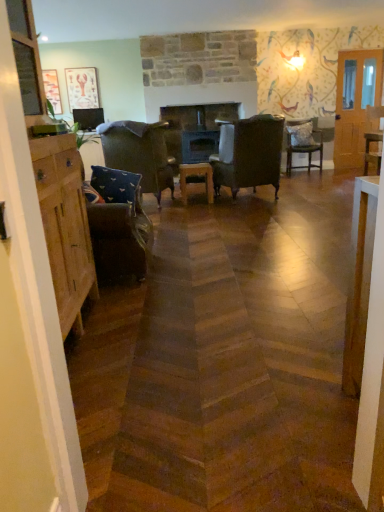
Question: From the image's perspective, does matte paper picture frame at upper left, the 1th picture frame viewed from the right, appear lower than patterned fabric chair at center-right, arranged as the third chair when viewed from the left?

Choices:
 (A) no
 (B) yes

Answer: (A)

Question: Is matte paper picture frame at upper left, the 1th picture frame viewed from the right, looking in the opposite direction of patterned fabric chair at center-right, arranged as the third chair when viewed from the left?

Choices:
 (A) yes
 (B) no

Answer: (B)

Question: Is matte paper picture frame at upper left, the 1th picture frame viewed from the right, to the left of patterned fabric chair at center-right, which is counted as the second chair, starting from the right, from the viewer's perspective?

Choices:
 (A) no
 (B) yes

Answer: (B)

Question: Can you confirm if matte paper picture frame at upper left, the second picture frame when ordered from left to right, is wider than patterned fabric chair at center-right, which is counted as the second chair, starting from the right?

Choices:
 (A) no
 (B) yes

Answer: (A)

Question: Is matte paper picture frame at upper left, the 1th picture frame viewed from the right, positioned far away from patterned fabric chair at center-right, which is counted as the second chair, starting from the right?

Choices:
 (A) yes
 (B) no

Answer: (A)

Question: From a real-world perspective, relative to smooth dark wood fireplace at center, is wooden stool at center vertically above or below?

Choices:
 (A) above
 (B) below

Answer: (B)

Question: Would you say wooden stool at center is to the left or to the right of smooth dark wood fireplace at center in the picture?

Choices:
 (A) right
 (B) left

Answer: (B)

Question: Is wooden stool at center in front of or behind smooth dark wood fireplace at center in the image?

Choices:
 (A) behind
 (B) front

Answer: (B)

Question: In terms of width, does wooden stool at center look wider or thinner when compared to smooth dark wood fireplace at center?

Choices:
 (A) thin
 (B) wide

Answer: (A)

Question: In terms of height, does matte paper picture frame at upper left, the 1th picture frame viewed from the right, look taller or shorter compared to wooden stool at center?

Choices:
 (A) short
 (B) tall

Answer: (B)

Question: Considering the positions of matte paper picture frame at upper left, the second picture frame when ordered from left to right, and wooden stool at center in the image, is matte paper picture frame at upper left, the second picture frame when ordered from left to right, bigger or smaller than wooden stool at center?

Choices:
 (A) big
 (B) small

Answer: (B)

Question: From a real-world perspective, is matte paper picture frame at upper left, the 1th picture frame viewed from the right, physically located above or below wooden stool at center?

Choices:
 (A) below
 (B) above

Answer: (B)

Question: Does point (74, 83) appear closer or farther from the camera than point (182, 182)?

Choices:
 (A) closer
 (B) farther

Answer: (B)

Question: Visually, is textured gray pillow at center-right, which ranks as the first pillow in right-to-left order, positioned to the left or to the right of matte wooden picture frame at upper left, which is the first picture frame in left-to-right order?

Choices:
 (A) right
 (B) left

Answer: (A)

Question: Is textured gray pillow at center-right, which ranks as the first pillow in right-to-left order, spatially inside matte wooden picture frame at upper left, which is the 2th picture frame in right-to-left order, or outside of it?

Choices:
 (A) inside
 (B) outside

Answer: (B)